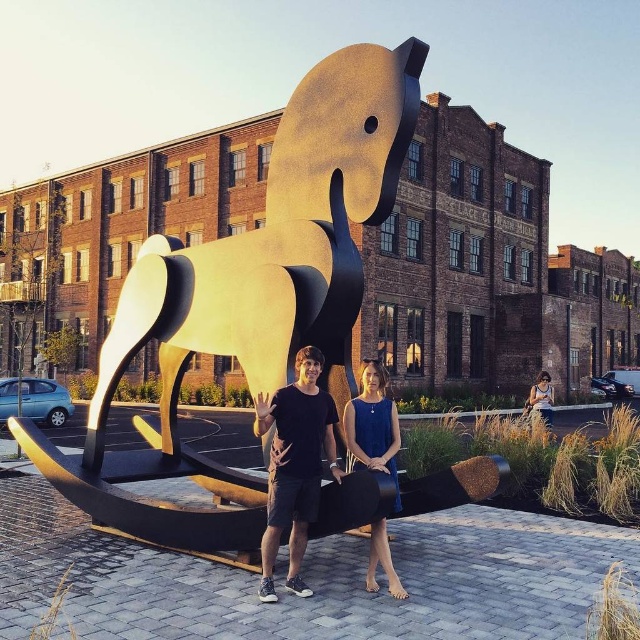
Question: Can you confirm if gold polished metal horse at center is positioned above blue satin dress at center?

Choices:
 (A) yes
 (B) no

Answer: (A)

Question: Which point is closer to the camera?

Choices:
 (A) black matte shirt at center
 (B) blue satin dress at center

Answer: (B)

Question: Among these points, which one is farthest from the camera?

Choices:
 (A) (230, 333)
 (B) (307, 500)
 (C) (396, 422)

Answer: (A)

Question: Does gold polished metal horse at center lie behind denim dress at lower right?

Choices:
 (A) yes
 (B) no

Answer: (B)

Question: Is gold polished metal horse at center below blue satin dress at center?

Choices:
 (A) yes
 (B) no

Answer: (B)

Question: Which is nearer to the blue satin dress at center?

Choices:
 (A) denim dress at lower right
 (B) gold polished metal horse at center
 (C) black matte shirt at center

Answer: (C)